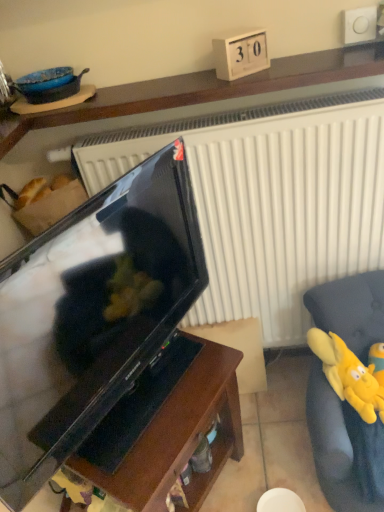
The width and height of the screenshot is (384, 512). I want to click on yellow plush toy at right, so click(348, 375).

What do you see at coordinates (90, 315) in the screenshot?
I see `matte black television at center` at bounding box center [90, 315].

The height and width of the screenshot is (512, 384). Describe the element at coordinates (167, 432) in the screenshot. I see `black glossy tv stand at center, arranged as the 1th furniture when ordered from the bottom` at that location.

Where is `yellow plush toy at right, the second furniture when ordered from top to bottom`? yellow plush toy at right, the second furniture when ordered from top to bottom is located at coordinates (344, 448).

Find the location of `wooden shelf at upper center, the third furniture in the bottom-to-top sequence`. wooden shelf at upper center, the third furniture in the bottom-to-top sequence is located at coordinates (202, 89).

What are the coordinates of `furniture lying on the left of wooden shelf at upper center, the third furniture in the bottom-to-top sequence` in the screenshot? It's located at (167, 432).

Is black glossy tv stand at center, arranged as the 1th furniture when ordered from the bottom, turned away from wooden shelf at upper center, which ranks as the 1th furniture in top-to-bottom order?

No, black glossy tv stand at center, arranged as the 1th furniture when ordered from the bottom, is not facing the opposite direction of wooden shelf at upper center, which ranks as the 1th furniture in top-to-bottom order.

Considering the points (100, 481) and (192, 86), which point is behind, point (100, 481) or point (192, 86)?

Point (192, 86)

Would you say yellow plush toy at right, the second furniture when ordered from top to bottom, is to the left or to the right of wooden shelf at upper center, which ranks as the 1th furniture in top-to-bottom order, in the picture?

Clearly, yellow plush toy at right, the second furniture when ordered from top to bottom, is on the right of wooden shelf at upper center, which ranks as the 1th furniture in top-to-bottom order, in the image.

Measure the distance from yellow plush toy at right, which is counted as the 2th furniture, starting from the bottom, to wooden shelf at upper center, which ranks as the 1th furniture in top-to-bottom order.

yellow plush toy at right, which is counted as the 2th furniture, starting from the bottom, is 33.35 inches away from wooden shelf at upper center, which ranks as the 1th furniture in top-to-bottom order.

Can you confirm if yellow plush toy at right, which is counted as the 2th furniture, starting from the bottom, is thinner than wooden shelf at upper center, which ranks as the 1th furniture in top-to-bottom order?

In fact, yellow plush toy at right, which is counted as the 2th furniture, starting from the bottom, might be wider than wooden shelf at upper center, which ranks as the 1th furniture in top-to-bottom order.

Is yellow plush toy at right, the second furniture when ordered from top to bottom, oriented towards wooden shelf at upper center, which ranks as the 1th furniture in top-to-bottom order?

No, yellow plush toy at right, the second furniture when ordered from top to bottom, does not turn towards wooden shelf at upper center, which ranks as the 1th furniture in top-to-bottom order.

Is wooden shelf at upper center, the third furniture in the bottom-to-top sequence, oriented away from yellow plush toy at right, the second furniture when ordered from top to bottom?

That's not correct — wooden shelf at upper center, the third furniture in the bottom-to-top sequence, is not looking away from yellow plush toy at right, the second furniture when ordered from top to bottom.

Looking at this image, does wooden shelf at upper center, which ranks as the 1th furniture in top-to-bottom order, lie in front of yellow plush toy at right, the second furniture when ordered from top to bottom?

No.

Is wooden shelf at upper center, the third furniture in the bottom-to-top sequence, with yellow plush toy at right, the second furniture when ordered from top to bottom?

They are not placed beside each other.

In terms of width, does wooden shelf at upper center, which ranks as the 1th furniture in top-to-bottom order, look wider or thinner when compared to yellow plush toy at right, which is counted as the 2th furniture, starting from the bottom?

Considering their sizes, wooden shelf at upper center, which ranks as the 1th furniture in top-to-bottom order, looks slimmer than yellow plush toy at right, which is counted as the 2th furniture, starting from the bottom.

How distant is matte black television at center from yellow plush toy at right?

matte black television at center and yellow plush toy at right are 26.24 inches apart from each other.

Considering the relative sizes of matte black television at center and yellow plush toy at right in the image provided, is matte black television at center wider than yellow plush toy at right?

Incorrect, the width of matte black television at center does not surpass that of yellow plush toy at right.

Is matte black television at center looking in the opposite direction of yellow plush toy at right?

No, matte black television at center is not facing the opposite direction of yellow plush toy at right.

Which object is further away from the camera, matte black television at center or yellow plush toy at right?

yellow plush toy at right is more distant.

From the image's perspective, which object appears higher, yellow plush toy at right or wooden shelf at upper center, which ranks as the 1th furniture in top-to-bottom order?

wooden shelf at upper center, which ranks as the 1th furniture in top-to-bottom order, is shown above in the image.

Locate an element on the screen. The height and width of the screenshot is (512, 384). toy that is behind the wooden shelf at upper center, which ranks as the 1th furniture in top-to-bottom order is located at coordinates (348, 375).

Is yellow plush toy at right to the right of wooden shelf at upper center, which ranks as the 1th furniture in top-to-bottom order, from the viewer's perspective?

Indeed, yellow plush toy at right is positioned on the right side of wooden shelf at upper center, which ranks as the 1th furniture in top-to-bottom order.

From a real-world perspective, between yellow plush toy at right, which is counted as the 2th furniture, starting from the bottom, and matte black television at center, who is vertically lower?

In real-world perspective, yellow plush toy at right, which is counted as the 2th furniture, starting from the bottom, is lower.

Is matte black television at center located within yellow plush toy at right, the second furniture when ordered from top to bottom?

That's incorrect, matte black television at center is not inside yellow plush toy at right, the second furniture when ordered from top to bottom.

Consider the image. Which of these two, yellow plush toy at right, the second furniture when ordered from top to bottom, or matte black television at center, is thinner?

Thinner between the two is matte black television at center.

Is wooden shelf at upper center, which ranks as the 1th furniture in top-to-bottom order, positioned with its back to black glossy tv stand at center, which is the third furniture in top-to-bottom order?

No, black glossy tv stand at center, which is the third furniture in top-to-bottom order, is not at the back of wooden shelf at upper center, which ranks as the 1th furniture in top-to-bottom order.

Which object is closer to the camera taking this photo, wooden shelf at upper center, the third furniture in the bottom-to-top sequence, or black glossy tv stand at center, arranged as the 1th furniture when ordered from the bottom?

Positioned in front is black glossy tv stand at center, arranged as the 1th furniture when ordered from the bottom.

Looking at this image, considering the relative sizes of wooden shelf at upper center, the third furniture in the bottom-to-top sequence, and black glossy tv stand at center, arranged as the 1th furniture when ordered from the bottom, in the image provided, is wooden shelf at upper center, the third furniture in the bottom-to-top sequence, thinner than black glossy tv stand at center, arranged as the 1th furniture when ordered from the bottom,?

Yes.

Is wooden shelf at upper center, the third furniture in the bottom-to-top sequence, inside the boundaries of black glossy tv stand at center, which is the third furniture in top-to-bottom order, or outside?

The correct answer is: outside.

Identify the location of furniture that is the 2nd object directly below the wooden shelf at upper center, the third furniture in the bottom-to-top sequence (from a real-world perspective). (167, 432).

I want to click on the 1st furniture below the wooden shelf at upper center, the third furniture in the bottom-to-top sequence (from the image's perspective), so click(x=344, y=448).

Based on their spatial positions, is yellow plush toy at right or matte black television at center further from black glossy tv stand at center, which is the third furniture in top-to-bottom order?

yellow plush toy at right.

When comparing their distances from matte black television at center, does yellow plush toy at right or yellow plush toy at right, which is counted as the 2th furniture, starting from the bottom, seem closer?

yellow plush toy at right, which is counted as the 2th furniture, starting from the bottom, is closer to matte black television at center.

In the scene shown: Estimate the real-world distances between objects in this image. Which object is closer to wooden shelf at upper center, which ranks as the 1th furniture in top-to-bottom order, matte black television at center or black glossy tv stand at center, arranged as the 1th furniture when ordered from the bottom?

The object closer to wooden shelf at upper center, which ranks as the 1th furniture in top-to-bottom order, is matte black television at center.

Considering their positions, is wooden shelf at upper center, the third furniture in the bottom-to-top sequence, positioned further to matte black television at center than yellow plush toy at right, the second furniture when ordered from top to bottom?

yellow plush toy at right, the second furniture when ordered from top to bottom.

From the picture: Looking at the image, which one is located further to yellow plush toy at right, matte black television at center or yellow plush toy at right, the second furniture when ordered from top to bottom?

matte black television at center.

From the image, which object appears to be farther from yellow plush toy at right, wooden shelf at upper center, the third furniture in the bottom-to-top sequence, or black glossy tv stand at center, arranged as the 1th furniture when ordered from the bottom?

Among the two, wooden shelf at upper center, the third furniture in the bottom-to-top sequence, is located further to yellow plush toy at right.

Estimate the real-world distances between objects in this image. Which object is closer to black glossy tv stand at center, arranged as the 1th furniture when ordered from the bottom, yellow plush toy at right or yellow plush toy at right, which is counted as the 2th furniture, starting from the bottom?

Among the two, yellow plush toy at right, which is counted as the 2th furniture, starting from the bottom, is located nearer to black glossy tv stand at center, arranged as the 1th furniture when ordered from the bottom.

From the image, which object appears to be nearer to yellow plush toy at right, the second furniture when ordered from top to bottom, matte black television at center or black glossy tv stand at center, arranged as the 1th furniture when ordered from the bottom?

Among the two, black glossy tv stand at center, arranged as the 1th furniture when ordered from the bottom, is located nearer to yellow plush toy at right, the second furniture when ordered from top to bottom.

Locate an element on the screen. The height and width of the screenshot is (512, 384). toy located between matte black television at center and yellow plush toy at right, which is counted as the 2th furniture, starting from the bottom, in the left-right direction is located at coordinates (348, 375).

Locate an element on the screen. The image size is (384, 512). toy between wooden shelf at upper center, which ranks as the 1th furniture in top-to-bottom order, and yellow plush toy at right, the second furniture when ordered from top to bottom, from top to bottom is located at coordinates (348, 375).

Locate an element on the screen. The width and height of the screenshot is (384, 512). television between wooden shelf at upper center, the third furniture in the bottom-to-top sequence, and yellow plush toy at right from top to bottom is located at coordinates (90, 315).

The height and width of the screenshot is (512, 384). In order to click on television between wooden shelf at upper center, which ranks as the 1th furniture in top-to-bottom order, and yellow plush toy at right, the second furniture when ordered from top to bottom, from top to bottom in this screenshot , I will do pos(90,315).